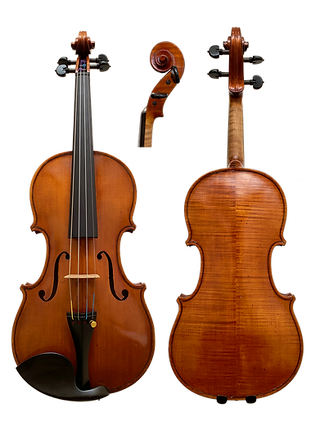
Where is `knob`? The height and width of the screenshot is (430, 320). knob is located at coordinates (102, 68).